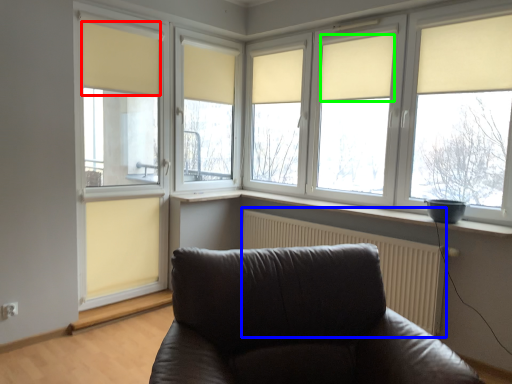
Question: Which object is positioned farthest from curtain (highlighted by a red box)? Select from radiator (highlighted by a blue box) and curtain (highlighted by a green box).

Choices:
 (A) radiator
 (B) curtain

Answer: (A)